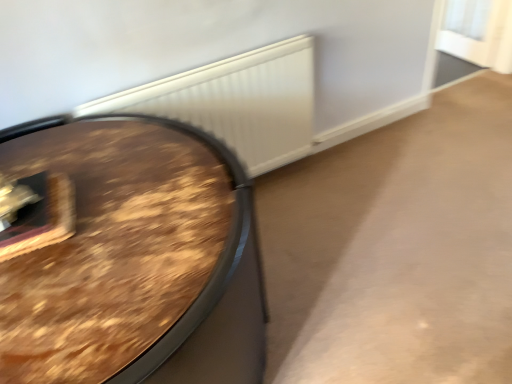
I want to click on vacant space to the right of white textured radiator at center, so click(333, 196).